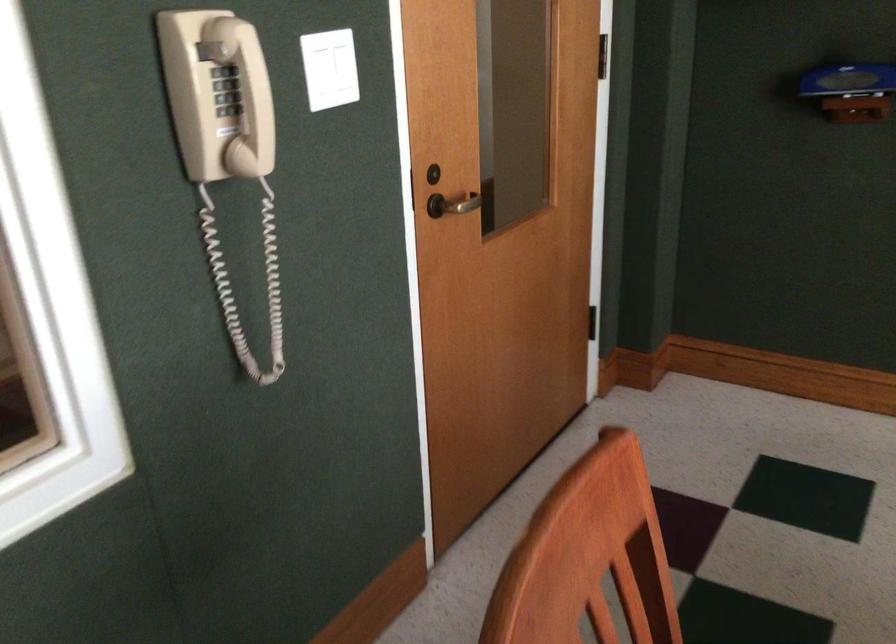
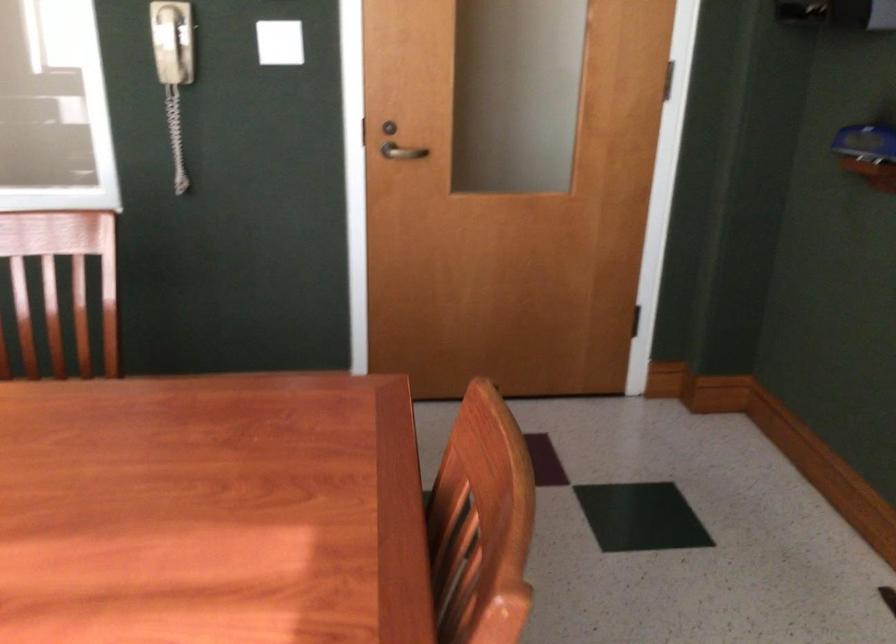
Where in the second image is the point corresponding to [458,201] from the first image?

(401, 152)